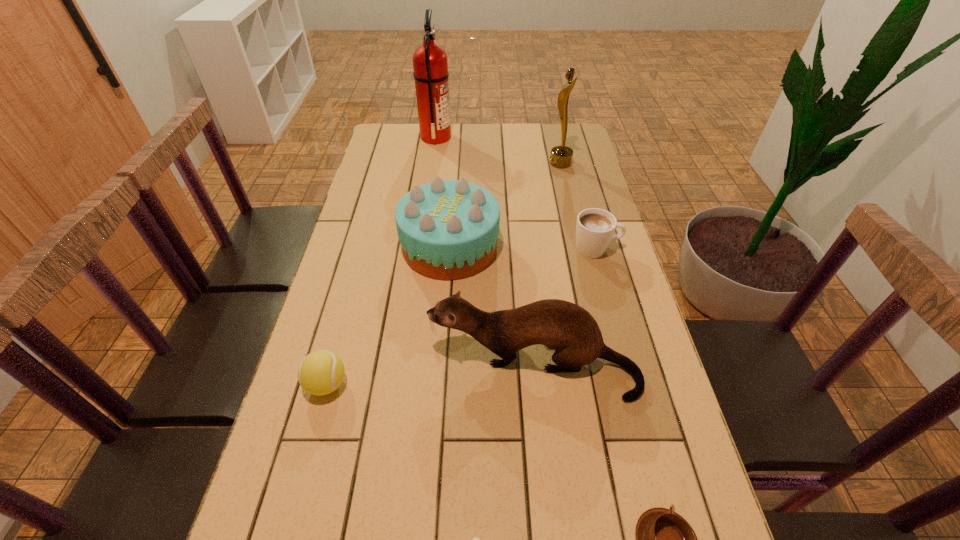
At what (x,y) coordinates should I click in order to perform the action: click on object at the left edge. Please return your answer as a coordinate pair (x, y). The height and width of the screenshot is (540, 960). Looking at the image, I should click on (321, 372).

Locate an element on the screen. The image size is (960, 540). award at the right edge is located at coordinates (561, 156).

The image size is (960, 540). I want to click on ferret that is at the right edge, so click(x=571, y=330).

Locate an element on the screen. cappuccino located at the right edge is located at coordinates (595, 227).

In order to click on blank area at the far edge in this screenshot , I will do `click(468, 145)`.

At what (x,y) coordinates should I click in order to perform the action: click on vacant space at the left edge of the desktop. Please return your answer as a coordinate pair (x, y). The width and height of the screenshot is (960, 540). Looking at the image, I should click on (382, 281).

Find the location of `vacant space at the right edge of the desktop`. vacant space at the right edge of the desktop is located at coordinates (598, 320).

Locate an element on the screen. This screenshot has width=960, height=540. vacant space at the far right corner is located at coordinates (583, 153).

At what (x,y) coordinates should I click in order to perform the action: click on empty space between the seventh shortest object and the brown ferret. Please return your answer as a coordinate pair (x, y). Looking at the image, I should click on (547, 265).

You are a GUI agent. You are given a task and a screenshot of the screen. Output one action in this format:
    pyautogui.click(x=<x>, y=<y>)
    Task: Click on the object that is the third closest to the brown ferret
    
    Given the screenshot: What is the action you would take?
    pyautogui.click(x=664, y=539)